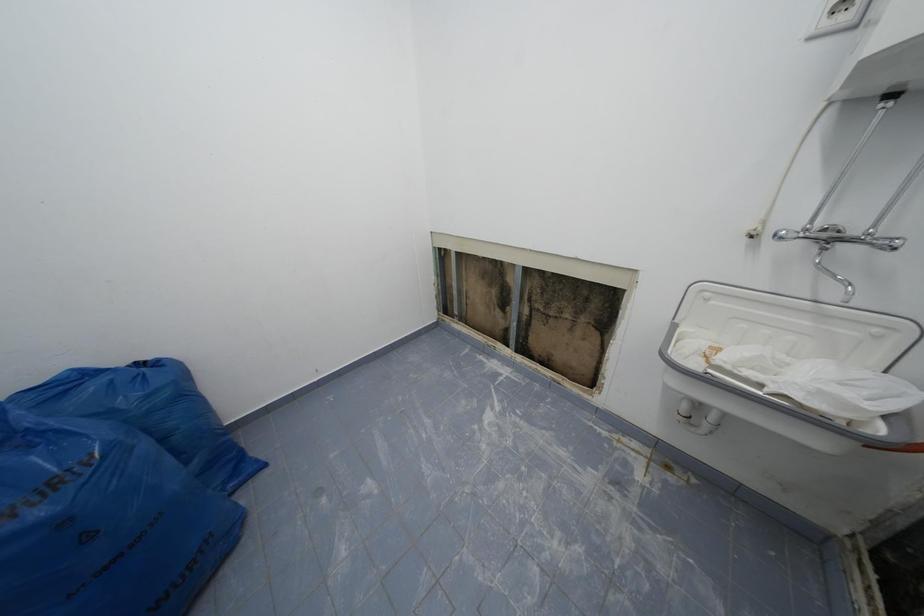
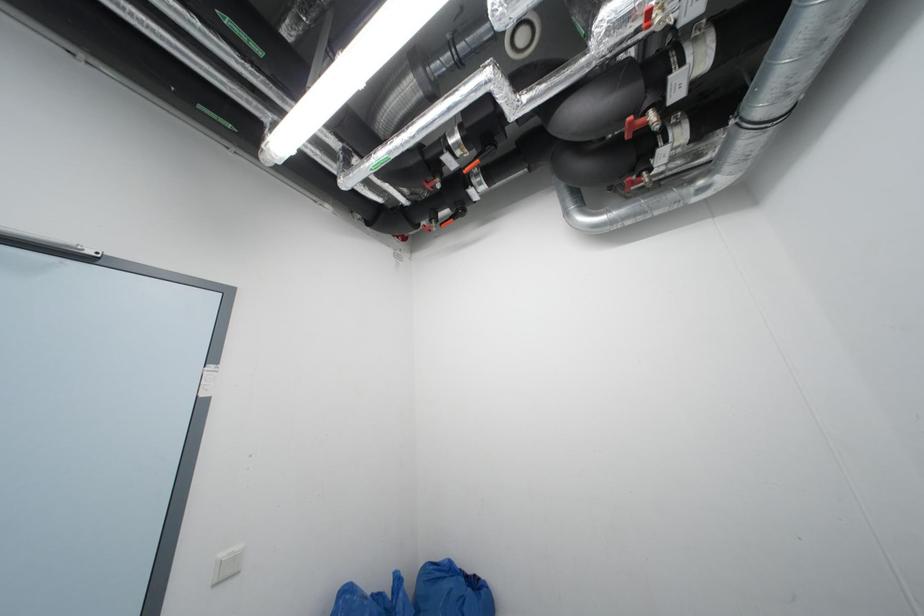
The images are taken continuously from a first-person perspective. In which direction is your viewpoint rotating?

The rotation direction of the camera is left-up.